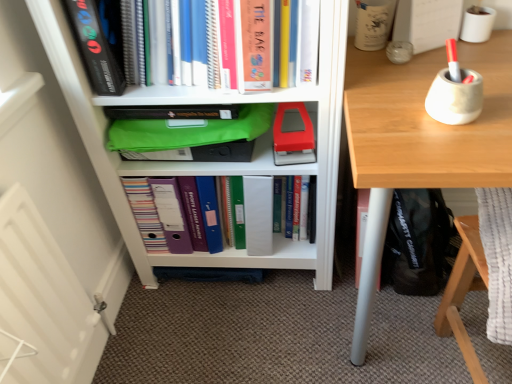
This screenshot has width=512, height=384. I want to click on vacant area on top of light wood desk at right (from a real-world perspective), so click(x=442, y=66).